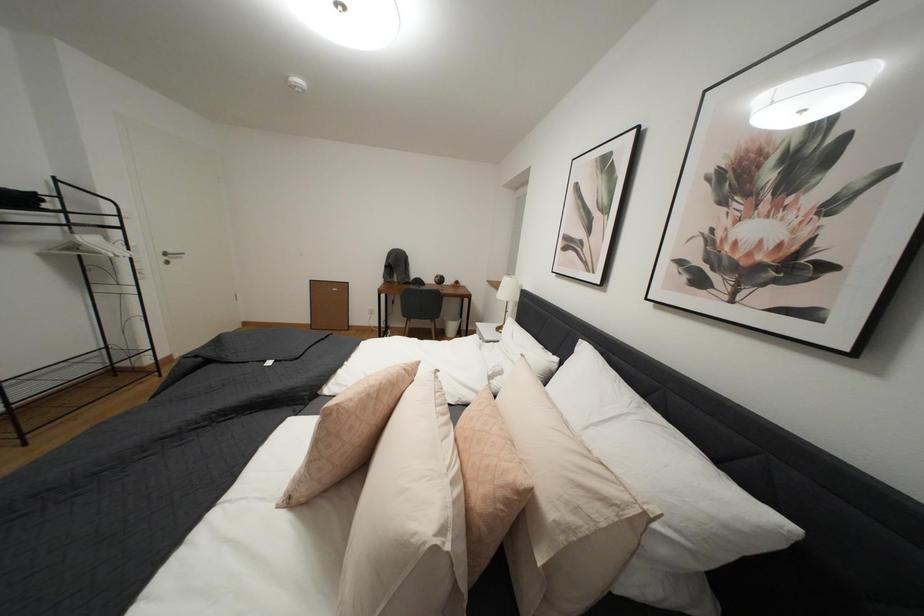
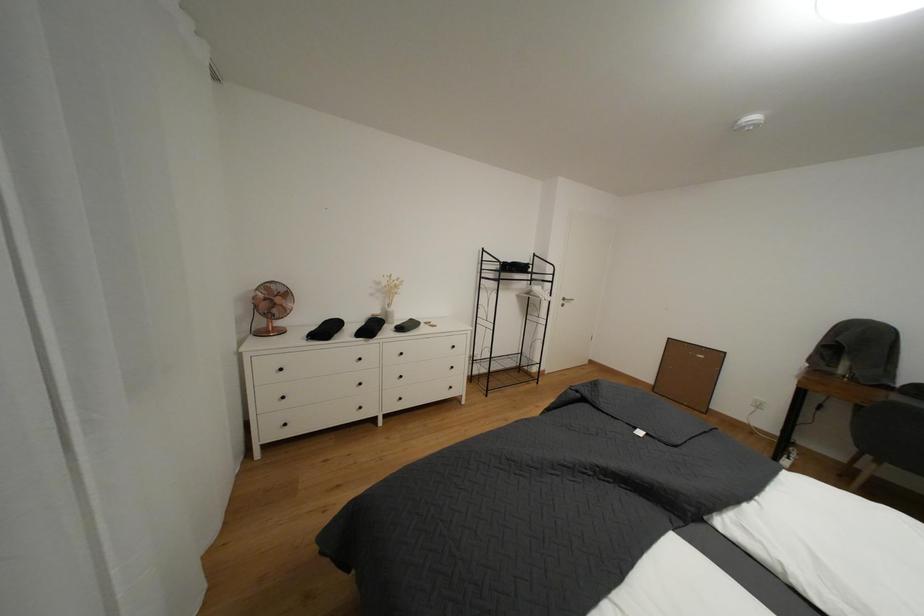
Question: The camera is either moving clockwise (left) or counter-clockwise (right) around the object. The first image is from the beginning of the video and the second image is from the end. Is the camera moving left or right when shooting the video?

Choices:
 (A) Left
 (B) Right

Answer: (B)